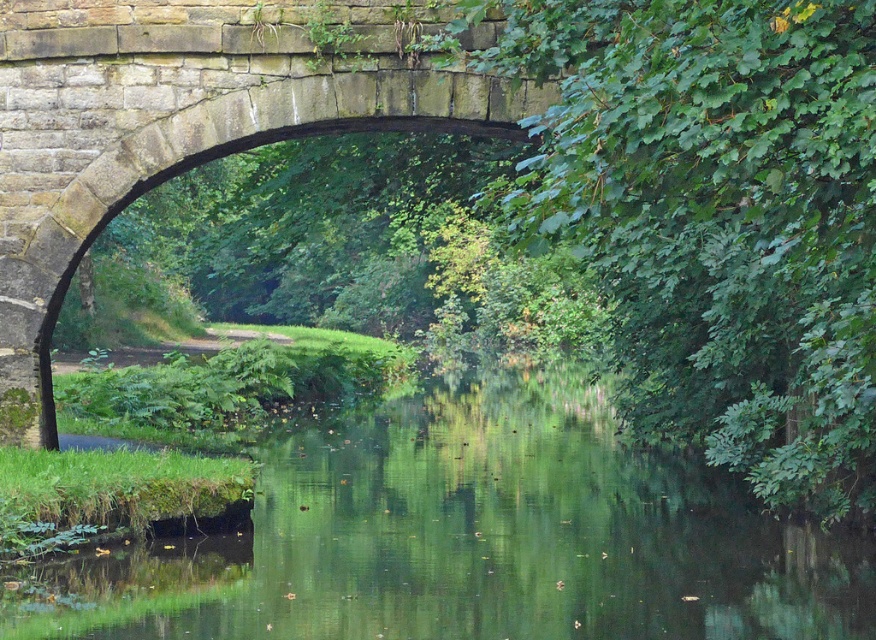
Question: Can you confirm if green smooth water at center is bigger than stone bridge at center?

Choices:
 (A) yes
 (B) no

Answer: (A)

Question: Is green smooth water at center further to the viewer compared to stone bridge at center?

Choices:
 (A) yes
 (B) no

Answer: (B)

Question: Which point is farther to the camera?

Choices:
 (A) stone bridge at center
 (B) green smooth water at center

Answer: (A)

Question: Which of the following is the farthest from the observer?

Choices:
 (A) stone bridge at center
 (B) green smooth water at center

Answer: (A)

Question: Which of the following is the closest to the observer?

Choices:
 (A) (285, 512)
 (B) (26, 324)

Answer: (B)

Question: Does green smooth water at center appear on the right side of stone bridge at center?

Choices:
 (A) no
 (B) yes

Answer: (B)